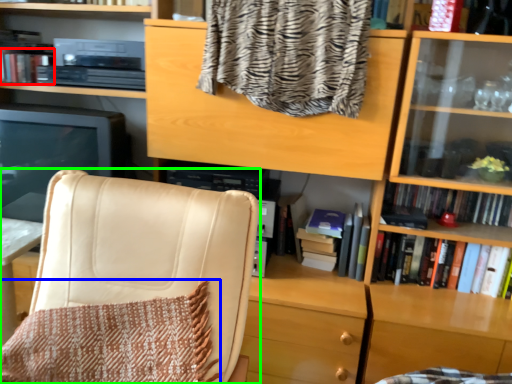
Question: Estimate the real-world distances between objects in this image. Which object is farther from book (highlighted by a red box), blanket (highlighted by a blue box) or chair (highlighted by a green box)?

Choices:
 (A) blanket
 (B) chair

Answer: (A)